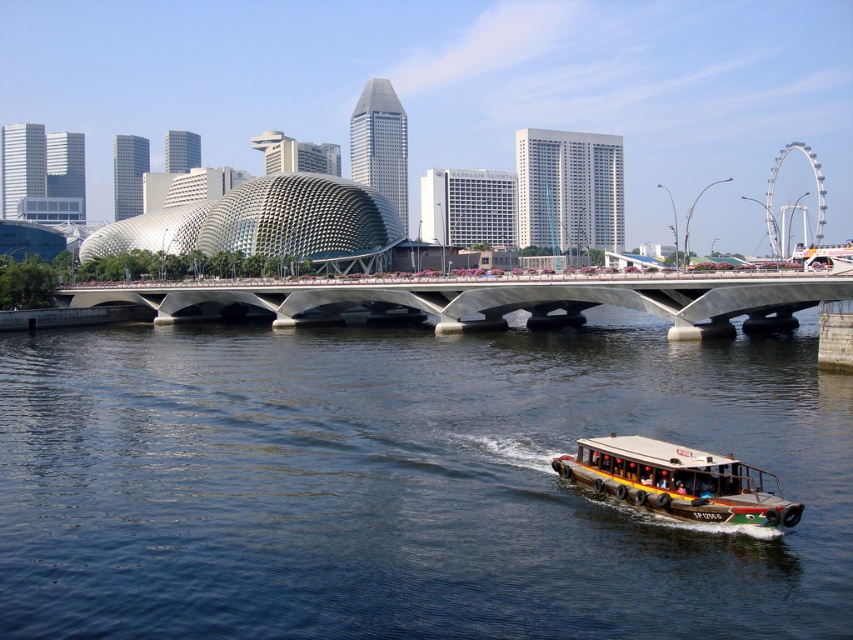
Question: Is concrete bridge at center thinner than yellow-green painted wooden boat at lower right?

Choices:
 (A) yes
 (B) no

Answer: (B)

Question: Based on their relative distances, which object is nearer to the concrete bridge at center?

Choices:
 (A) dark blue water at center
 (B) yellow-green painted wooden boat at lower right

Answer: (A)

Question: Considering the real-world distances, which object is farthest from the concrete bridge at center?

Choices:
 (A) dark blue water at center
 (B) yellow-green painted wooden boat at lower right

Answer: (B)

Question: Is dark blue water at center below yellow-green painted wooden boat at lower right?

Choices:
 (A) no
 (B) yes

Answer: (A)

Question: Which of these objects is positioned farthest from the yellow-green painted wooden boat at lower right?

Choices:
 (A) concrete bridge at center
 (B) dark blue water at center

Answer: (A)

Question: Does concrete bridge at center have a greater width compared to yellow-green painted wooden boat at lower right?

Choices:
 (A) yes
 (B) no

Answer: (A)